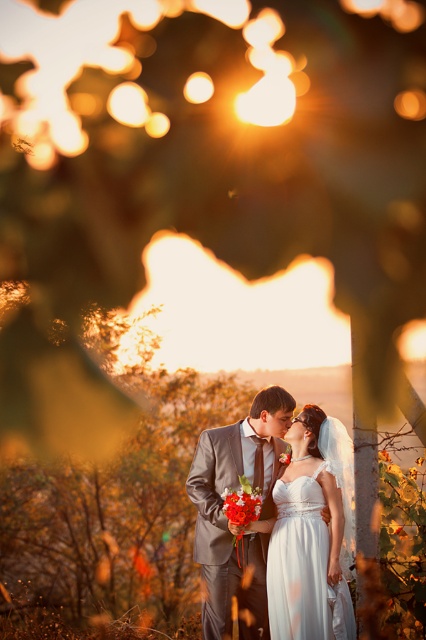
You are a photographer who needs to adjust the lighting for the couple in the image. Since the sun is low, you want to ensure both the matte gray suit at center and the white satin dress at center are well lit. Given their sizes, which one might require more focused lighting adjustments?

The matte gray suit at center is larger in size than the white satin dress at center, so it might require more focused lighting adjustments to ensure proper illumination.

You are a photographer standing at point (259, 442). You want to take a photo of the bride and groom who are 6.10 meters apart. Will you be able to capture both of them in the frame if your camera has a 50mm lens?

The bride and groom are 6.10 meters apart. With a 50mm lens, the maximum distance to capture both would depend on the camera sensor size and framing. Assuming a full frame sensor, a 50mm lens has a field of view that can comfortably include subjects 6 meters apart at a reasonable distance. Move closer if needed, but ensure the blurred background remains artistic.